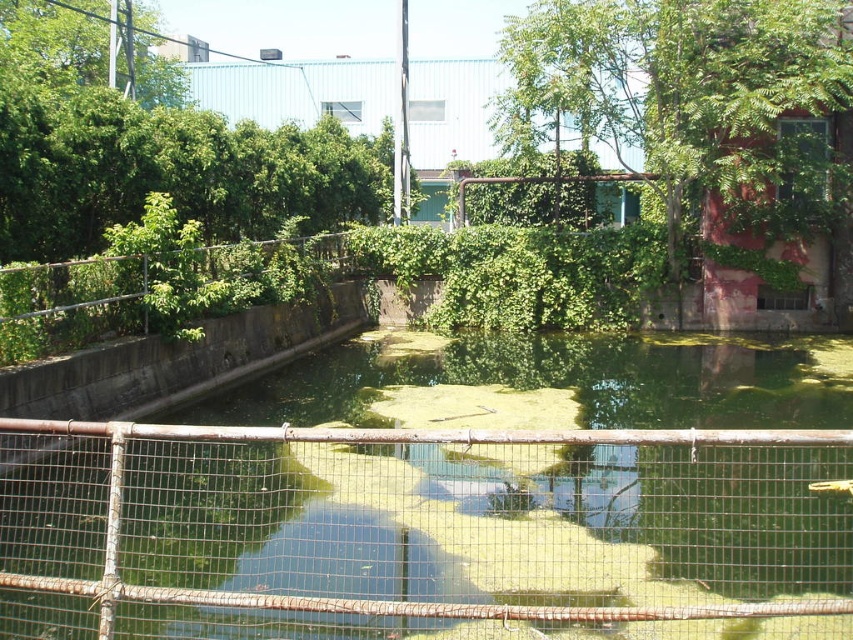
You are a drone operator tasked with capturing aerial footage of the green leafy tree at upper right. The drone has a maximum flight range of 15 meters. Can you safely capture the footage without exceeding the drone range limit?

The distance between the green leafy tree at upper right and the camera is 16.56 meters, which exceeds the drone operator maximum flight range of 15 meters. Therefore, the drone cannot safely capture the footage without exceeding the range limit.

You are a city planner reviewing this area. You notice the green leafy tree at upper right and the rusty metal fence at upper center. Which object takes up more space in the scene?

The green leafy tree at upper right is bigger than the rusty metal fence at upper center, so it takes up more space in the scene.

You are standing at the point marked as point (694, 99). What object is located at that point?

The green leafy tree at upper right is located at point (694, 99).